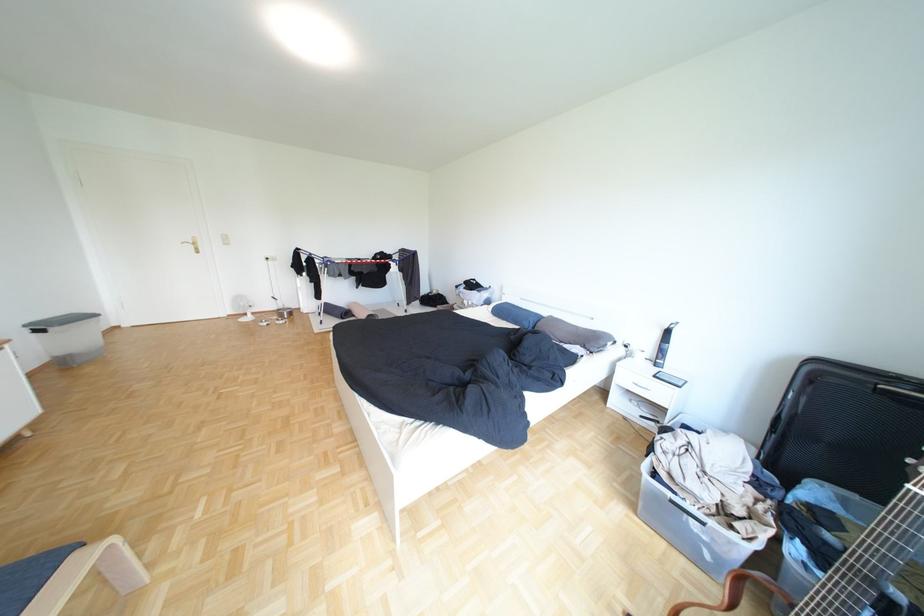
I want to click on chair sitting surface, so [30, 577].